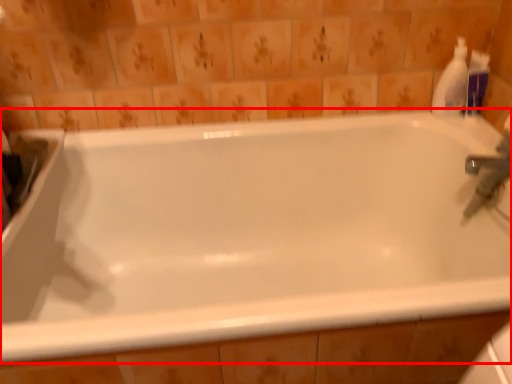
Question: From the image's perspective, where is bathtub (annotated by the red box) located relative to cleaning product?

Choices:
 (A) below
 (B) above

Answer: (A)